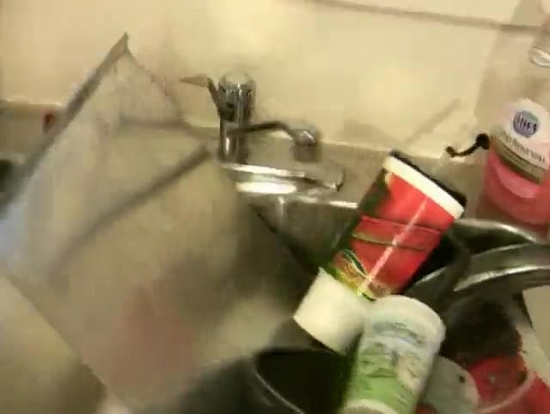
Where is `metal sink spout`? metal sink spout is located at coordinates (308, 139).